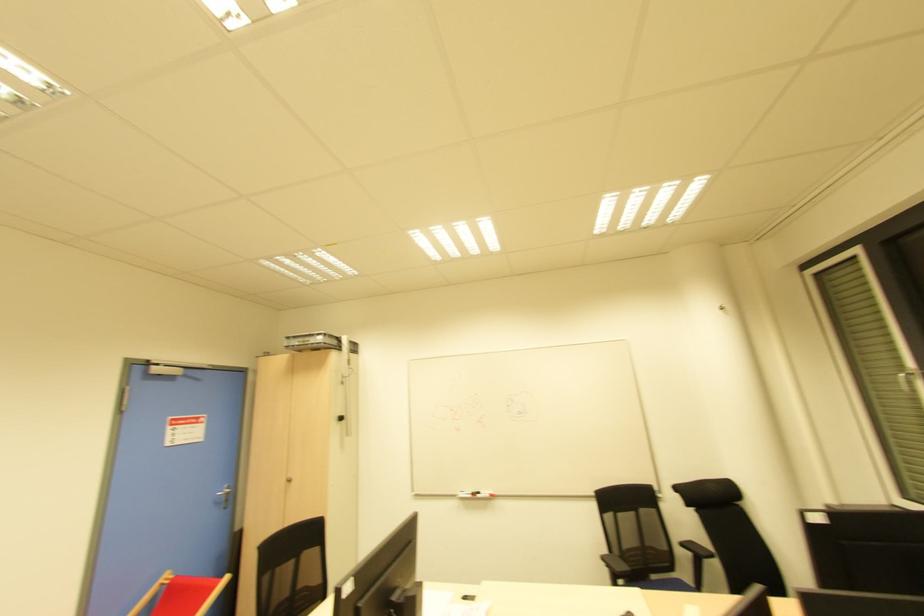
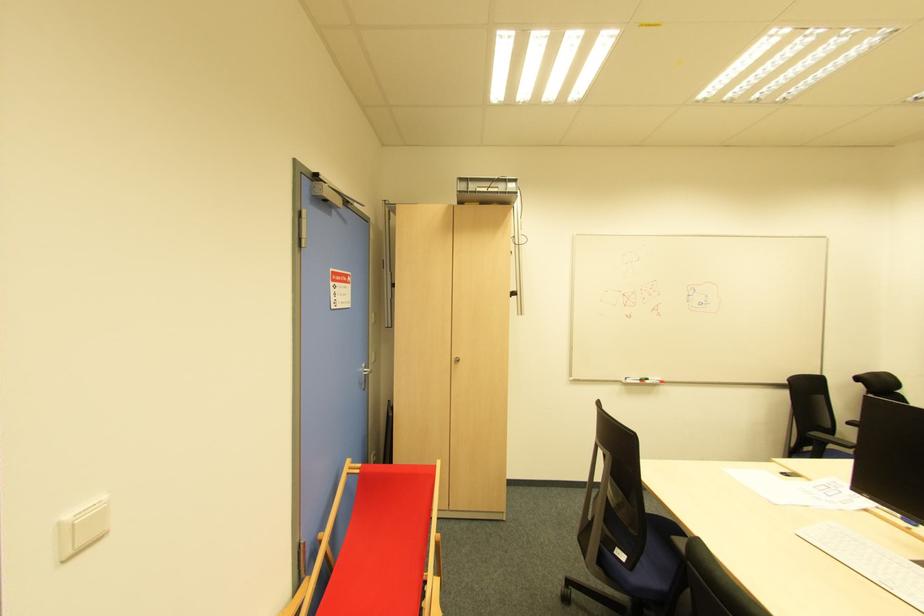
Where in the second image is the point corresponding to [288,482] from the first image?

(457, 362)